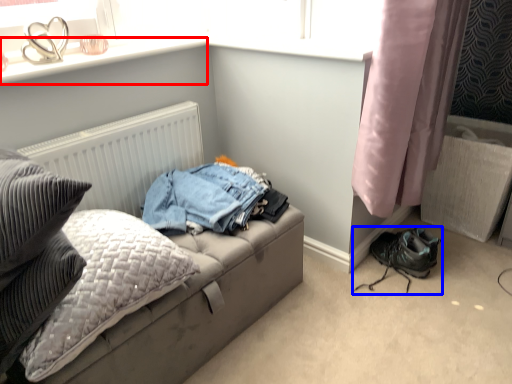
Question: Which of the following is the closest to the observer, window sill (highlighted by a red box) or footwear (highlighted by a blue box)?

Choices:
 (A) window sill
 (B) footwear

Answer: (A)